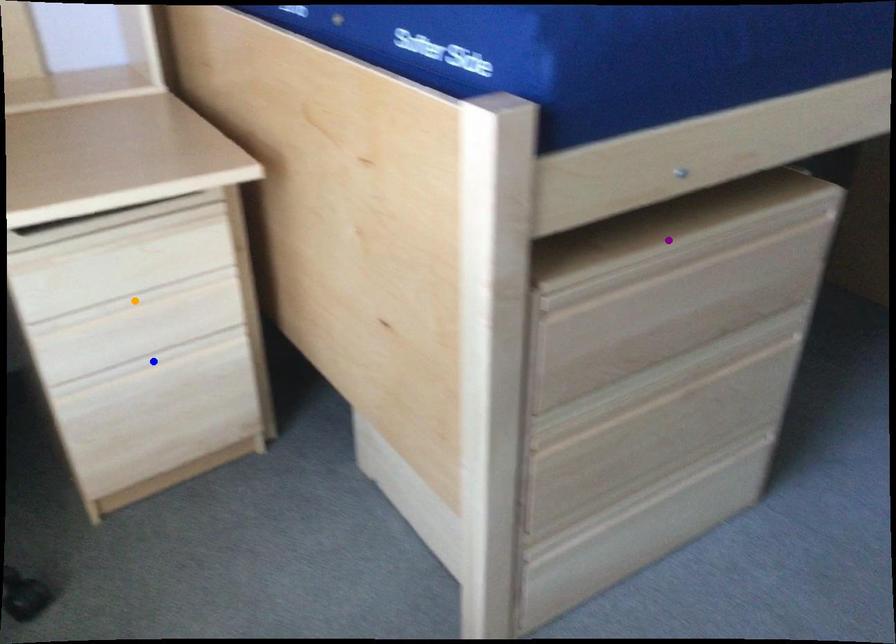
Order these from farthest to nearest:
purple point, blue point, orange point

blue point, orange point, purple point